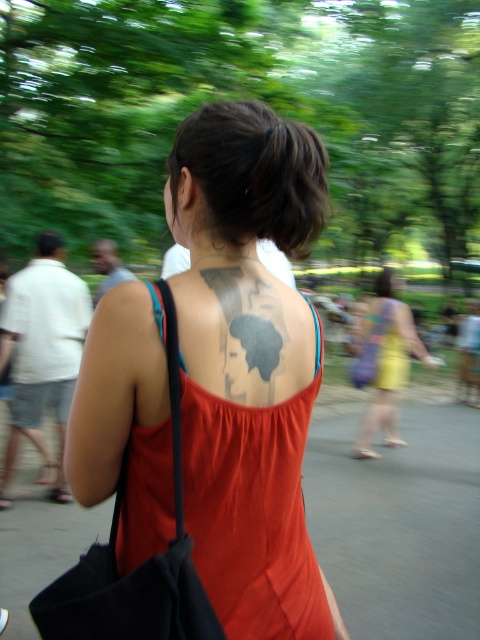
Question: Among these points, which one is farthest from the camera?

Choices:
 (A) (215, 289)
 (B) (264, 368)
 (C) (381, 282)

Answer: (C)

Question: Is black ink tattoo at upper back to the left of yellow fabric dress at center from the viewer's perspective?

Choices:
 (A) yes
 (B) no

Answer: (A)

Question: Is black ink tattoo at upper back closer to the viewer compared to yellow fabric dress at center?

Choices:
 (A) no
 (B) yes

Answer: (B)

Question: Considering the relative positions of matte black tattoo at upper center and black ink tattoo at upper back in the image provided, where is matte black tattoo at upper center located with respect to black ink tattoo at upper back?

Choices:
 (A) above
 (B) below

Answer: (B)

Question: Which of the following is the closest to the observer?

Choices:
 (A) [x=369, y=362]
 (B) [x=233, y=323]
 (C) [x=26, y=433]

Answer: (B)

Question: Based on their relative distances, which object is nearer to the dark gray tattoo at center back?

Choices:
 (A) matte black tattoo at upper center
 (B) yellow fabric dress at center
 (C) black ink tattoo at upper back

Answer: (C)